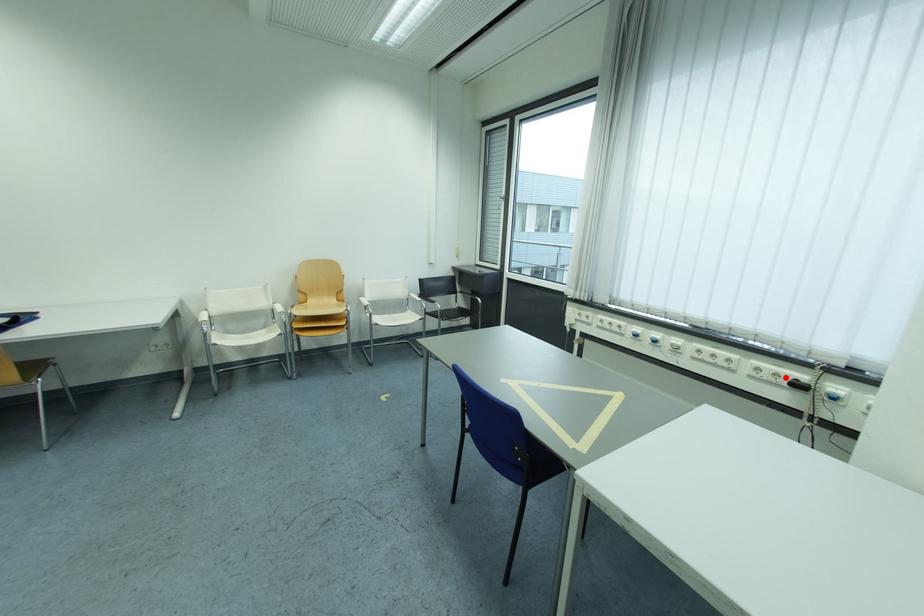
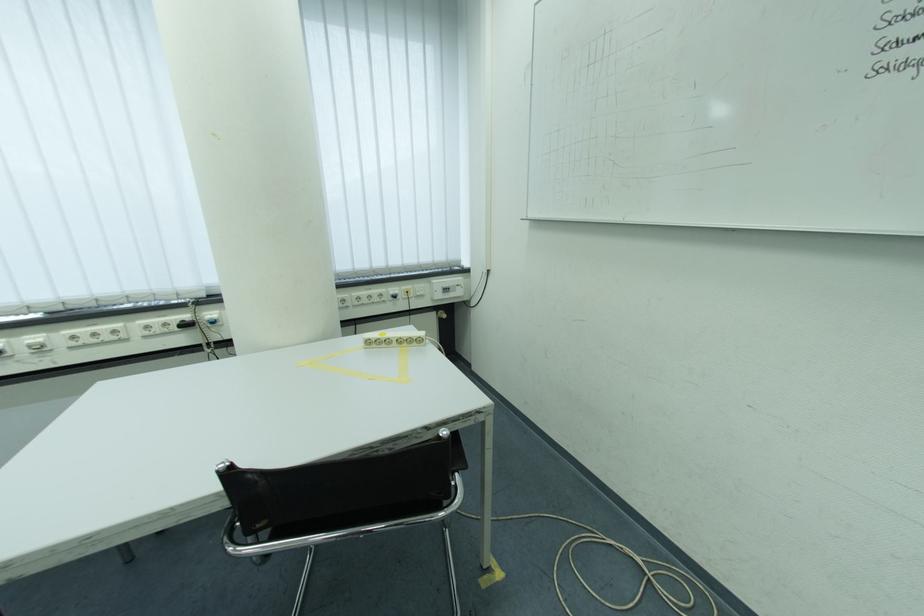
Find the pixel in the second image that matches the highlighted location in the first image.

(175, 326)